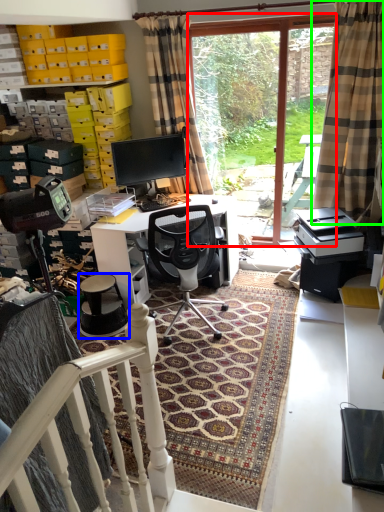
Question: Which object is the closest to the bay window (highlighted by a red box)? Choose among these: stool (highlighted by a blue box) or curtain (highlighted by a green box).

Choices:
 (A) stool
 (B) curtain

Answer: (B)